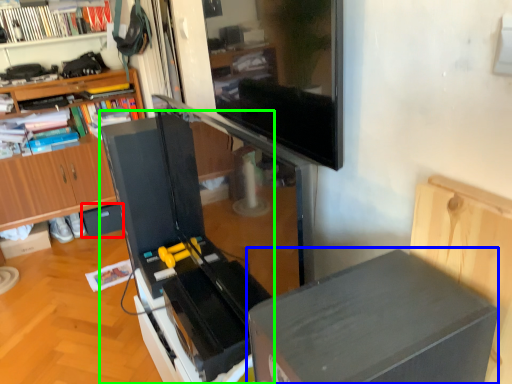
Question: Based on their relative distances, which object is farther from drawer (highlighted by a red box)? Choose from table (highlighted by a blue box) and appliance (highlighted by a green box).

Choices:
 (A) table
 (B) appliance

Answer: (A)